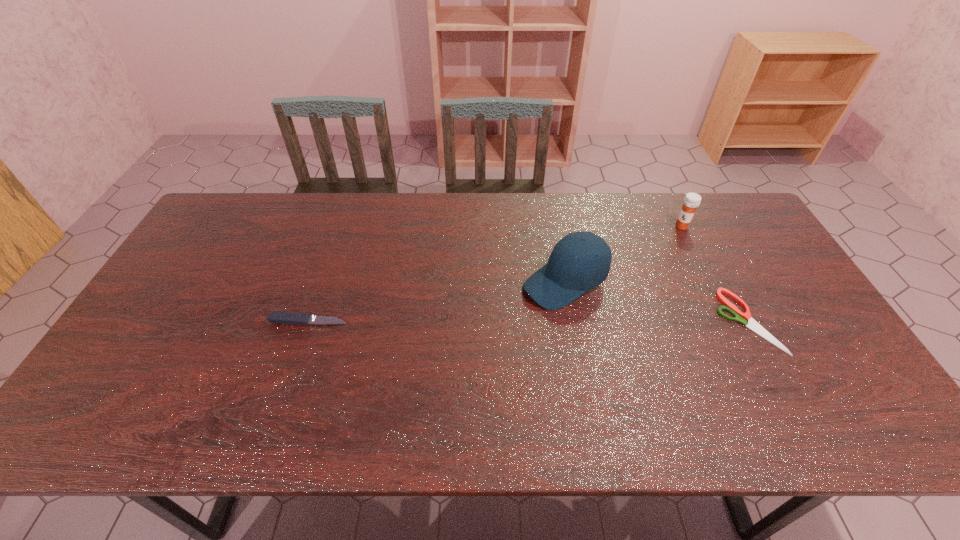
Find the location of a particular element. This screenshot has width=960, height=540. vacant space at the right edge of the desktop is located at coordinates (734, 260).

At what (x,y) coordinates should I click in order to perform the action: click on vacant space at the far left corner of the desktop. Please return your answer as a coordinate pair (x, y). This screenshot has height=540, width=960. Looking at the image, I should click on (242, 206).

Identify the location of vacant region at the far right corner of the desktop. (717, 235).

This screenshot has width=960, height=540. Find the location of `vacant space in between the baseball cap and the second tallest object`. vacant space in between the baseball cap and the second tallest object is located at coordinates (623, 254).

Locate an element on the screen. empty space between the shortest object and the second shortest object is located at coordinates (528, 321).

The width and height of the screenshot is (960, 540). Identify the location of free space between the scissors and the leftmost object. (528, 321).

You are a GUI agent. You are given a task and a screenshot of the screen. Output one action in this format:
    pyautogui.click(x=<x>, y=<y>)
    Task: Click on the unoccupied position between the shortest object and the tallest object
    The height and width of the screenshot is (540, 960).
    Given the screenshot: What is the action you would take?
    pyautogui.click(x=656, y=301)

I want to click on free spot between the baseball cap and the leftmost object, so click(437, 301).

The image size is (960, 540). I want to click on vacant space that is in between the tallest object and the farthest object, so click(623, 254).

I want to click on free space between the steak knife and the third shortest object, so click(495, 273).